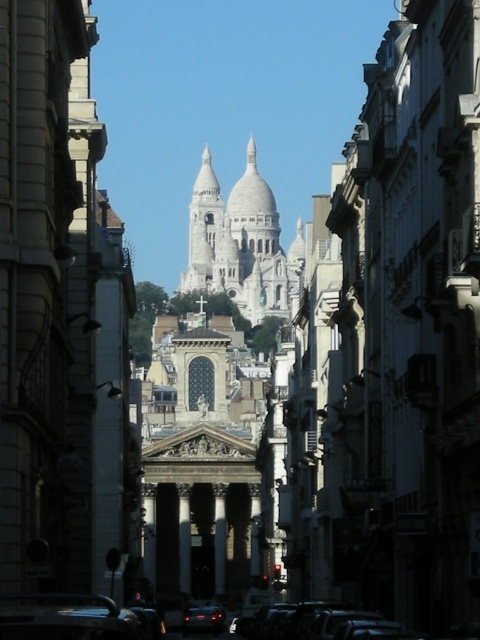
You are a delivery driver trying to park your shiny black car at lower center in a narrow street. The parking spot is at coordinates 0.966, 0.138. Can you safely park there without hitting the historic buildings flanking the street?

The shiny black car at lower center is already positioned at coordinates (66, 618), so it can be parked there safely without hitting the historic buildings flanking the street.

You are a delivery driver who needs to park your car in this street. You see two cars parked here, the black glossy car at lower center and the shiny black car at center. Which car takes up more space on the street?

The black glossy car at lower center takes up more space on the street because its width is larger than that of the shiny black car at center.